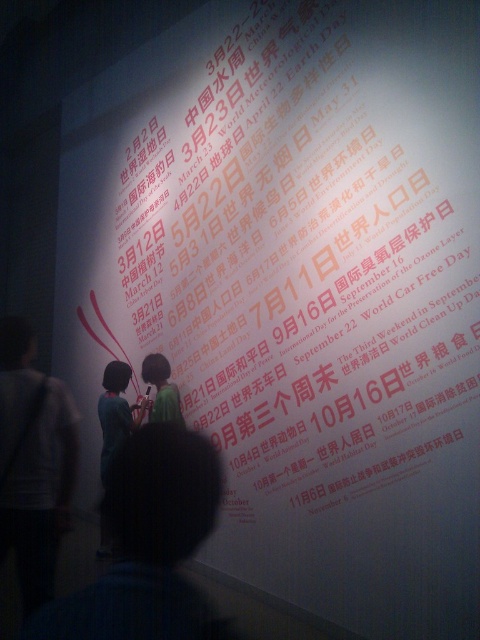
Who is lower down, dark blue shirt at center or dark green shirt at center?

dark green shirt at center is below.

Between point (97, 593) and point (104, 531), which one is positioned in front?

Positioned in front is point (97, 593).

The width and height of the screenshot is (480, 640). In order to click on dark blue shirt at center in this screenshot , I will do `click(149, 545)`.

Between point (41, 524) and point (157, 371), which one is positioned in front?

Point (41, 524) is more forward.

Where is `light gray jacket at left`? The height and width of the screenshot is (640, 480). light gray jacket at left is located at coordinates (34, 465).

Between point (28, 605) and point (157, 365), which one is positioned behind?

Point (157, 365)

Identify the location of light gray jacket at left. Image resolution: width=480 pixels, height=640 pixels. (34, 465).

Measure the distance between dark blue shirt at center and green fabric shirt at center.

dark blue shirt at center is 9.98 feet from green fabric shirt at center.

Does point (207, 513) come behind point (168, 385)?

That is False.

Who is more forward, (107, 634) or (154, 397)?

Point (107, 634) is in front.

The width and height of the screenshot is (480, 640). In order to click on dark blue shirt at center in this screenshot , I will do `click(149, 545)`.